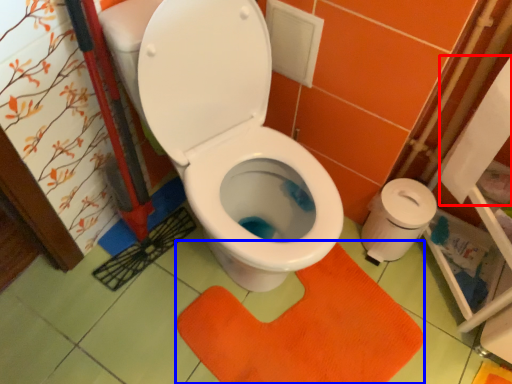
Question: Which point is further to the camera, toilet paper (highlighted by a red box) or doormat (highlighted by a blue box)?

Choices:
 (A) toilet paper
 (B) doormat

Answer: (B)